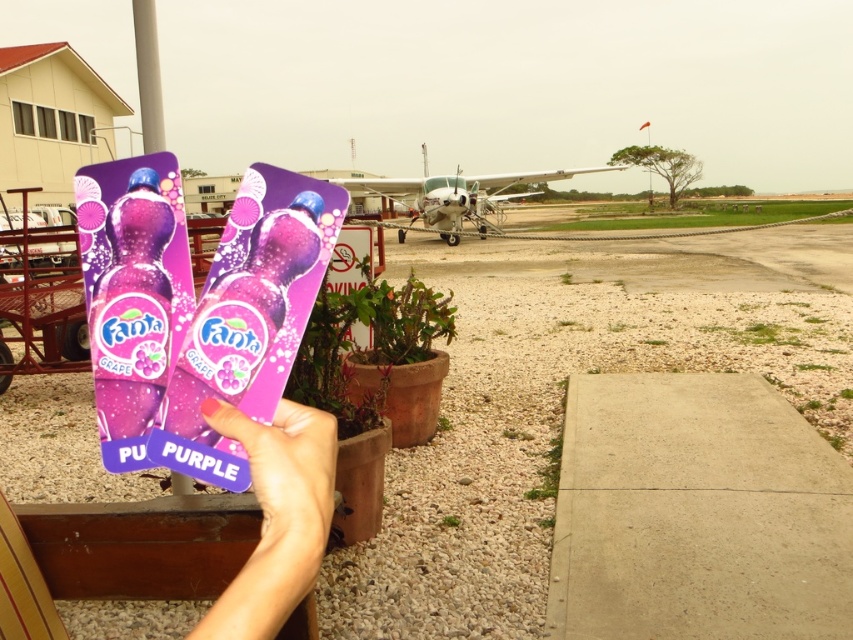
You are a delivery drone operator. Your drone is about to deliver a package to the purple matte card at lower left. The drone needs to hover at least 18 inches away from the delivery location to avoid obstacles. Can the drone safely hover at the required distance?

The distance of purple matte card at lower left from camera is 18.92 inches, so yes, the drone can safely hover at the required distance since it is slightly more than 18 inches away.

Based on the photo, you are a delivery person holding two packages of Fanta grape soda. You notice a purple matte card at lower left and a metallic silver airplane at center in your line of sight. Which object is closer to your left hand?

The purple matte card at lower left is positioned on the left side of metallic silver airplane at center, so it is closer to your left hand.